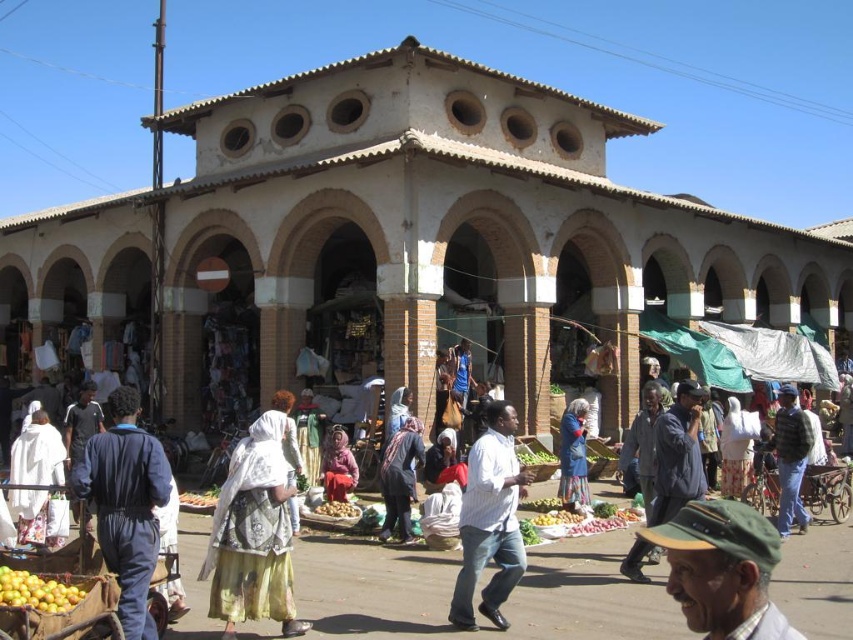
Based on the photo, who is higher up, printed fabric headscarf at center or yellow matte oranges at lower left?

Positioned higher is printed fabric headscarf at center.

In order to click on printed fabric headscarf at center in this screenshot , I will do `click(253, 532)`.

The height and width of the screenshot is (640, 853). What are the coordinates of `printed fabric headscarf at center` in the screenshot? It's located at (253, 532).

Which of these two, white cloth at center or yellow matte oranges at lower left, stands taller?

white cloth at center

Does white cloth at center have a lesser height compared to yellow matte oranges at lower left?

No, white cloth at center is not shorter than yellow matte oranges at lower left.

What do you see at coordinates (38, 452) in the screenshot? This screenshot has width=853, height=640. I see `white cloth at center` at bounding box center [38, 452].

Identify the location of white cloth at center. The width and height of the screenshot is (853, 640). 38,452.

Is point (57, 497) positioned before point (564, 486)?

Yes.

Does white cloth at center have a larger size compared to blue fabric at center?

Yes, white cloth at center is bigger than blue fabric at center.

Describe the element at coordinates (38, 452) in the screenshot. I see `white cloth at center` at that location.

The width and height of the screenshot is (853, 640). Find the location of `white cloth at center`. white cloth at center is located at coordinates (38, 452).